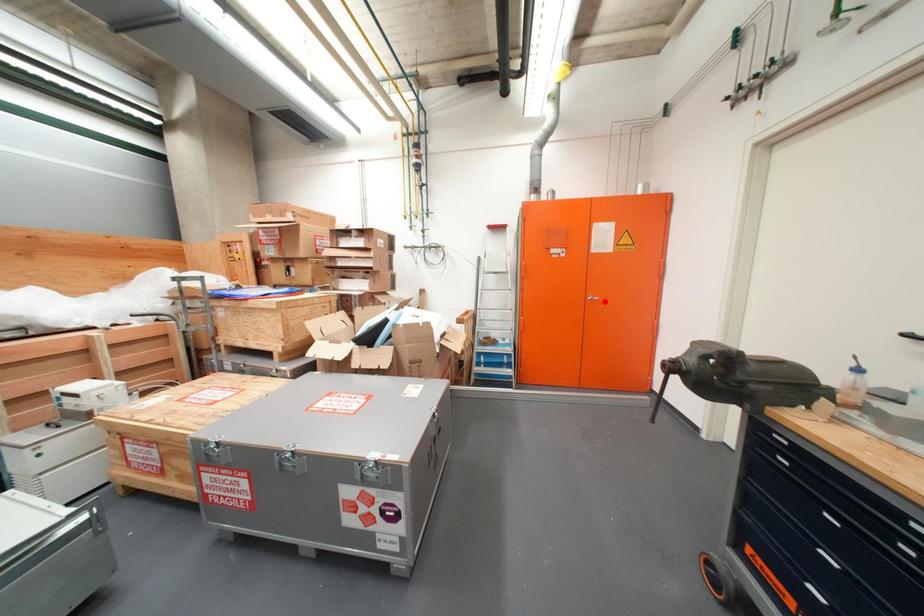
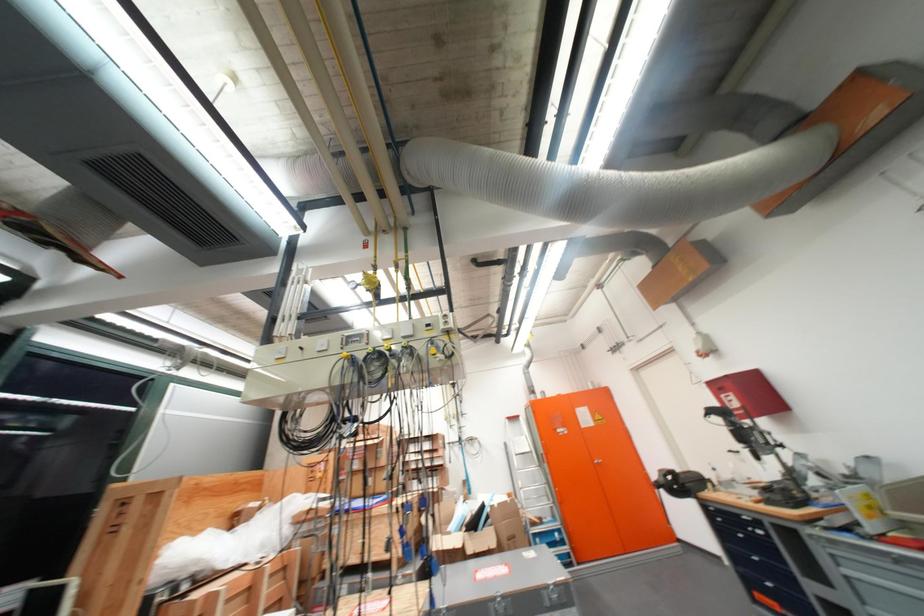
Question: A red point is marked in image1. In image2, is the corresponding 3D point closer to the camera or farther? Reply with the corresponding letter.

Choices:
 (A) The corresponding 3D point is closer.
 (B) The corresponding 3D point is farther.

Answer: (B)